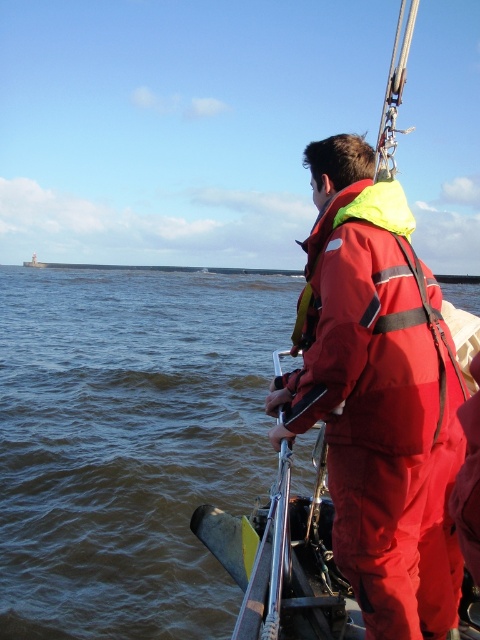
Question: In this image, where is metallic silver boat at center located relative to neon yellow fabric life jacket at center?

Choices:
 (A) below
 (B) above

Answer: (B)

Question: Which object is closer to the camera taking this photo?

Choices:
 (A) neon yellow fabric life jacket at center
 (B) metallic silver boat at center

Answer: (B)

Question: Is metallic silver boat at center to the right of neon yellow fabric life jacket at center from the viewer's perspective?

Choices:
 (A) yes
 (B) no

Answer: (A)

Question: Can you confirm if brown water at center is smaller than metallic silver boat at center?

Choices:
 (A) yes
 (B) no

Answer: (A)

Question: Among these points, which one is nearest to the camera?

Choices:
 (A) (132, 433)
 (B) (412, 218)
 (C) (412, 557)

Answer: (C)

Question: Which of the following is the closest to the observer?

Choices:
 (A) neon yellow fabric life jacket at center
 (B) brown water at center

Answer: (A)